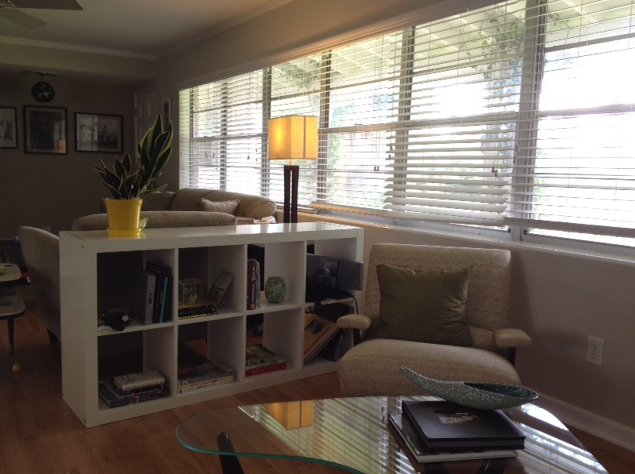
This screenshot has width=635, height=474. Find the location of `wooden floor`. wooden floor is located at coordinates (145, 448).